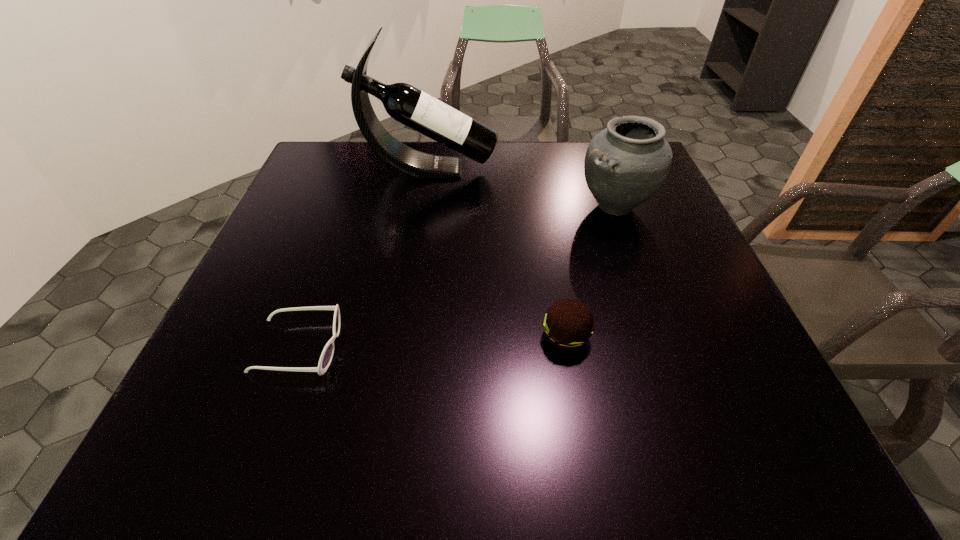
Locate an element on the screen. The height and width of the screenshot is (540, 960). wine bottle is located at coordinates (406, 104).

The height and width of the screenshot is (540, 960). In order to click on the tallest object in this screenshot , I will do [x=406, y=104].

Where is `urn`? This screenshot has width=960, height=540. urn is located at coordinates (626, 164).

You are a GUI agent. You are given a task and a screenshot of the screen. Output one action in this format:
    pyautogui.click(x=<x>, y=<y>)
    Task: Click on the rightmost object
    The width and height of the screenshot is (960, 540).
    Given the screenshot: What is the action you would take?
    pyautogui.click(x=626, y=164)

Locate an element on the screen. patty is located at coordinates [x=568, y=324].

At what (x,y) coordinates should I click in order to perform the action: click on the third tallest object. Please return your answer as a coordinate pair (x, y). Looking at the image, I should click on (568, 324).

The height and width of the screenshot is (540, 960). Find the location of `sunglasses`. sunglasses is located at coordinates pos(326,357).

Locate an element on the screen. The image size is (960, 540). free space located 0.210m on the stand of the farthest object is located at coordinates (571, 169).

What are the coordinates of `vacant space located on the front of the second tallest object` in the screenshot? It's located at (633, 254).

At what (x,y) coordinates should I click in order to perform the action: click on vacant region located 0.270m on the right of the third object from left to right. Please return your answer as a coordinate pair (x, y). This screenshot has width=960, height=540. Looking at the image, I should click on (734, 336).